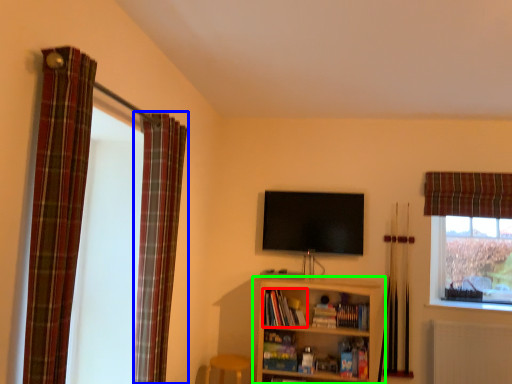
Question: Estimate the real-world distances between objects in this image. Which object is closer to book (highlighted by a red box), curtain (highlighted by a blue box) or shelf (highlighted by a green box)?

Choices:
 (A) curtain
 (B) shelf

Answer: (B)